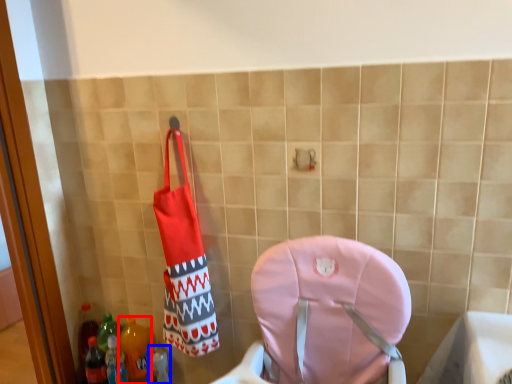
Question: Among these objects, which one is farthest to the camera, bottle (highlighted by a red box) or bottle (highlighted by a blue box)?

Choices:
 (A) bottle
 (B) bottle

Answer: (B)